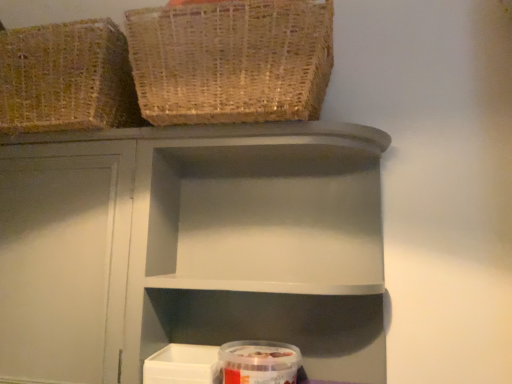
Question: Based on their sizes in the image, would you say woven natural basket at upper left, arranged as the 2th basket when viewed from the left, is bigger or smaller than transparent plastic container at lower center?

Choices:
 (A) big
 (B) small

Answer: (A)

Question: Is woven natural basket at upper left, arranged as the 2th basket when viewed from the left, in front of or behind transparent plastic container at lower center in the image?

Choices:
 (A) behind
 (B) front

Answer: (B)

Question: Which of these objects is positioned farthest from the matte gray shelf at center?

Choices:
 (A) woven natural basket at upper left, acting as the 1th basket starting from the right
 (B) woven natural basket at upper left, which is the second basket in right-to-left order
 (C) transparent plastic container at lower center

Answer: (C)

Question: Estimate the real-world distances between objects in this image. Which object is closer to the transparent plastic container at lower center?

Choices:
 (A) woven natural basket at upper left, arranged as the 2th basket when viewed from the left
 (B) matte gray shelf at center
 (C) woven natural basket at upper left, the 1th basket in the left-to-right sequence

Answer: (B)